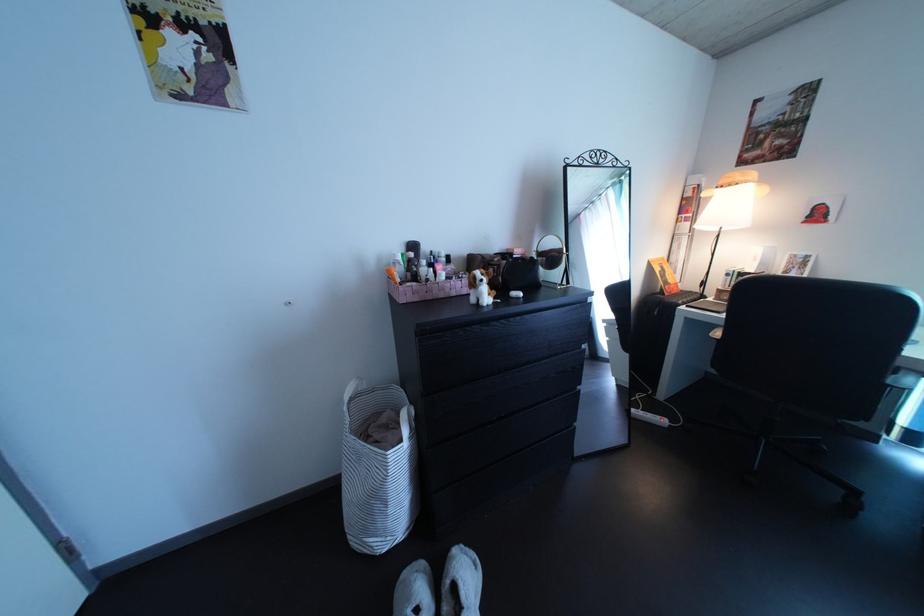
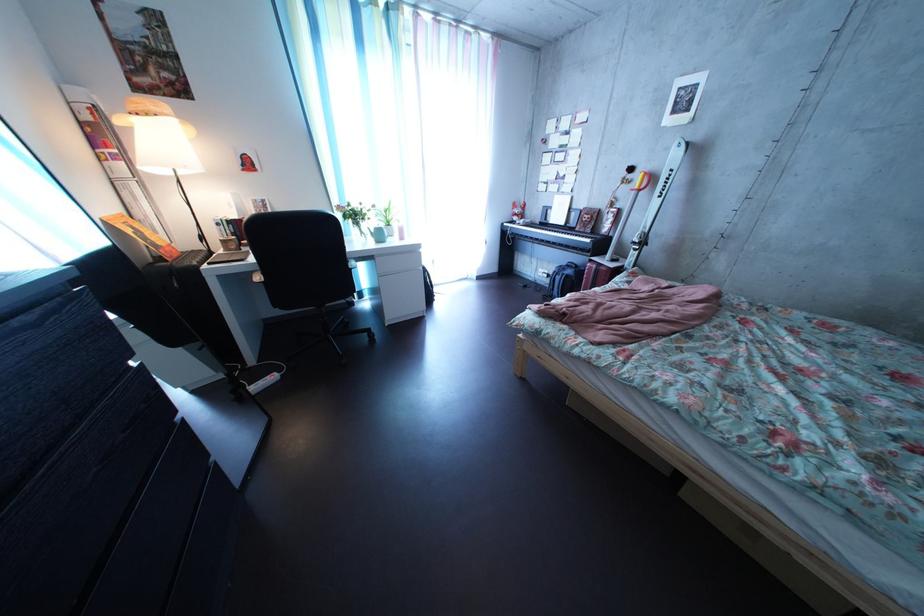
Find the pixel in the second image that matches point 672,278 in the first image.

(142, 238)